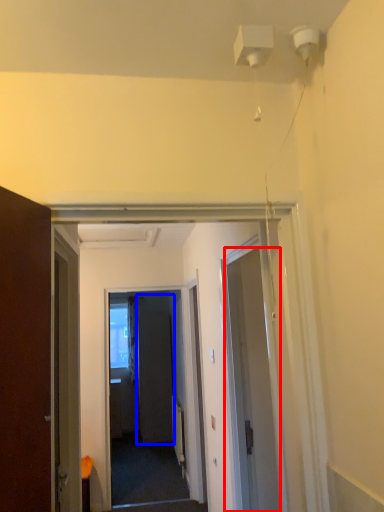
Question: Which of the following is the farthest to the observer, door (highlighted by a red box) or screen door (highlighted by a blue box)?

Choices:
 (A) door
 (B) screen door

Answer: (B)